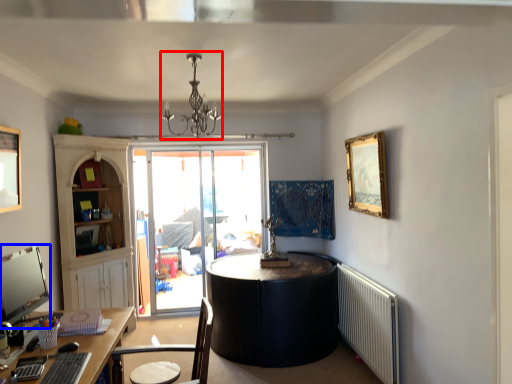
Question: Which object is further to the camera taking this photo, light fixture (highlighted by a red box) or computer monitor (highlighted by a blue box)?

Choices:
 (A) light fixture
 (B) computer monitor

Answer: (A)